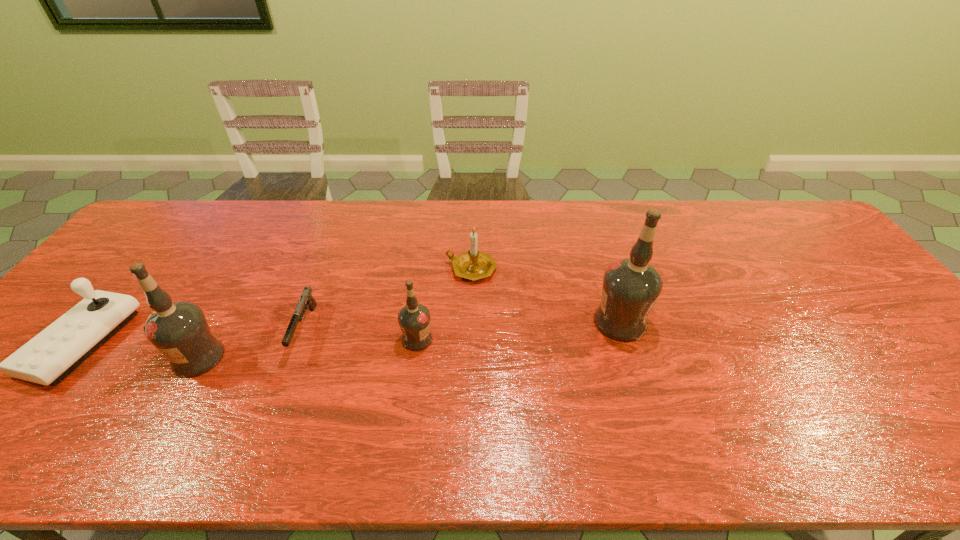
The image size is (960, 540). Find the location of `vacant space located on the front label of the rightmost object`. vacant space located on the front label of the rightmost object is located at coordinates (468, 322).

Image resolution: width=960 pixels, height=540 pixels. Find the location of `free space located 0.160m on the front label of the rightmost object`. free space located 0.160m on the front label of the rightmost object is located at coordinates [x=533, y=322].

Locate an element on the screen. The width and height of the screenshot is (960, 540). vacant space located on the front label of the rightmost object is located at coordinates (498, 322).

Locate an element on the screen. vacant space situated 0.070m at the muzzle end of the gun is located at coordinates (283, 386).

At what (x,y) coordinates should I click in order to perform the action: click on free space located on the left of the second object from right to left. Please return your answer as a coordinate pair (x, y). Looking at the image, I should click on (338, 269).

In the image, there is a desktop. Identify the location of vacant space at the far edge. This screenshot has width=960, height=540. (363, 215).

Identify the location of vacant area at the near edge. The image size is (960, 540). (795, 395).

In the image, there is a desktop. Identify the location of vacant space at the far left corner. (188, 211).

The width and height of the screenshot is (960, 540). I want to click on blank area at the near left corner, so click(19, 397).

Identify the location of empty space that is in between the farthest object and the leftmost vodka. The image size is (960, 540). (335, 313).